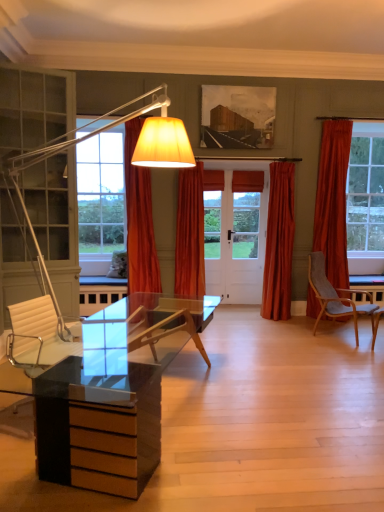
Question: Is the depth of wooden textured painting at upper center less than that of fluffy white pillow at left?

Choices:
 (A) yes
 (B) no

Answer: (A)

Question: From a real-world perspective, is wooden textured painting at upper center physically below fluffy white pillow at left?

Choices:
 (A) no
 (B) yes

Answer: (A)

Question: Can fluffy white pillow at left be found inside wooden textured painting at upper center?

Choices:
 (A) no
 (B) yes

Answer: (A)

Question: Does wooden textured painting at upper center have a lesser height compared to fluffy white pillow at left?

Choices:
 (A) no
 (B) yes

Answer: (A)

Question: Does wooden textured painting at upper center have a larger size compared to fluffy white pillow at left?

Choices:
 (A) no
 (B) yes

Answer: (B)

Question: Is orange fabric curtain at center, the 1th curtain positioned from the left, spatially inside wooden textured painting at upper center, or outside of it?

Choices:
 (A) inside
 (B) outside

Answer: (B)

Question: Is orange fabric curtain at center, the 1th curtain positioned from the left, taller or shorter than wooden textured painting at upper center?

Choices:
 (A) short
 (B) tall

Answer: (B)

Question: From the image's perspective, is orange fabric curtain at center, the 1th curtain positioned from the left, positioned above or below wooden textured painting at upper center?

Choices:
 (A) below
 (B) above

Answer: (A)

Question: Would you say orange fabric curtain at center, the third curtain viewed from the right, is to the left or to the right of wooden textured painting at upper center in the picture?

Choices:
 (A) left
 (B) right

Answer: (A)

Question: From the image's perspective, is velvet orange curtain at center, marked as the 1th curtain in a right-to-left arrangement, positioned above or below fluffy white pillow at left?

Choices:
 (A) below
 (B) above

Answer: (B)

Question: In terms of size, does velvet orange curtain at center, marked as the 1th curtain in a right-to-left arrangement, appear bigger or smaller than fluffy white pillow at left?

Choices:
 (A) small
 (B) big

Answer: (B)

Question: Does point (291, 238) appear closer or farther from the camera than point (110, 269)?

Choices:
 (A) closer
 (B) farther

Answer: (B)

Question: Do you think velvet orange curtain at center, marked as the 1th curtain in a right-to-left arrangement, is within fluffy white pillow at left, or outside of it?

Choices:
 (A) outside
 (B) inside

Answer: (A)

Question: Looking at their shapes, would you say orange velvet curtain at center, which is the second curtain from right to left, is wider or thinner than wooden textured painting at upper center?

Choices:
 (A) thin
 (B) wide

Answer: (B)

Question: Choose the correct answer: Is orange velvet curtain at center, the second curtain when ordered from left to right, inside wooden textured painting at upper center or outside it?

Choices:
 (A) inside
 (B) outside

Answer: (B)